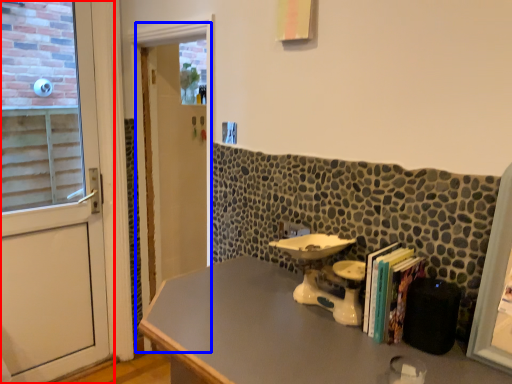
Question: Which point is closer to the camera, door (highlighted by a red box) or screen door (highlighted by a blue box)?

Choices:
 (A) door
 (B) screen door

Answer: (A)